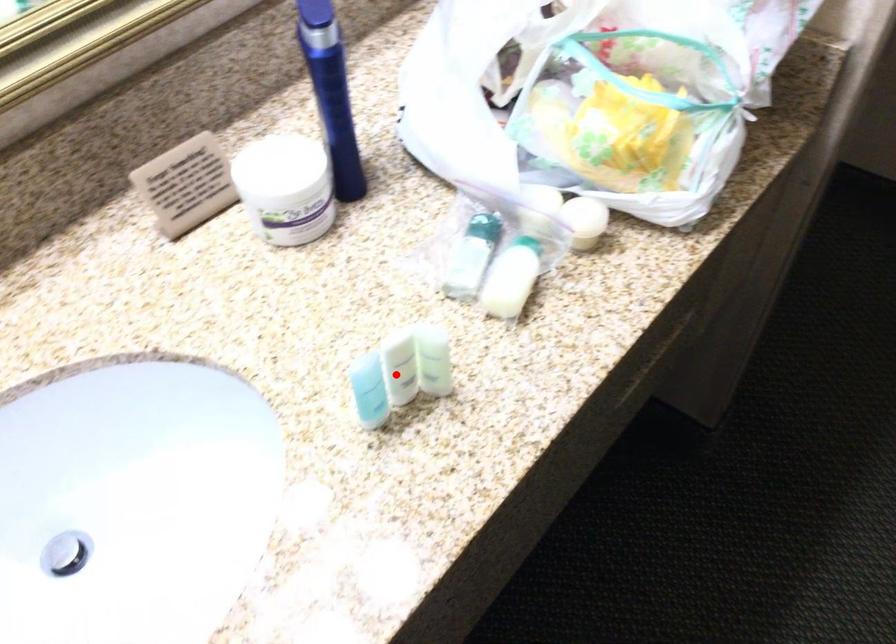
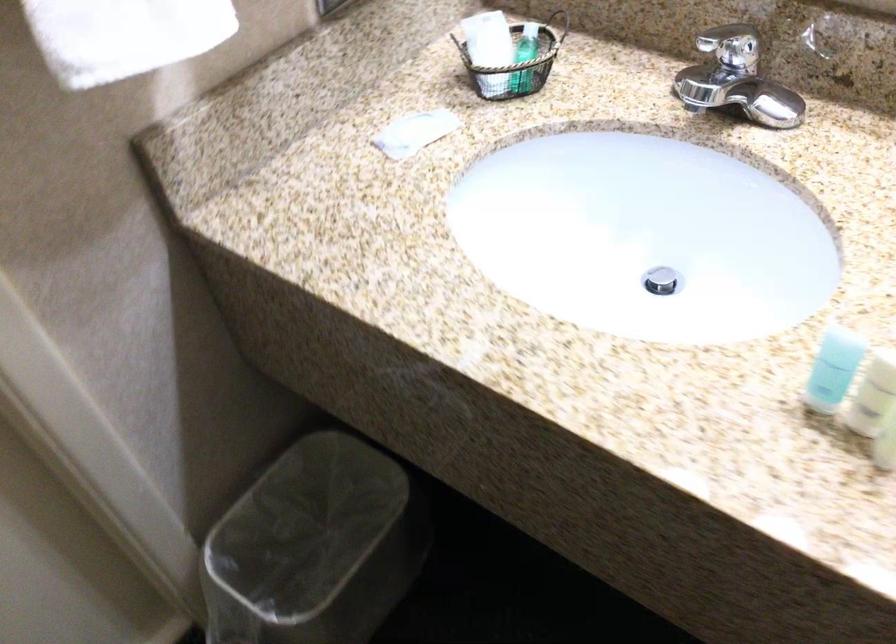
Question: I am providing you with two images of the same scene from different viewpoints. A red point is shown in image1. For the corresponding object point in image2, is it positioned nearer or farther from the camera?

Choices:
 (A) Nearer
 (B) Farther

Answer: (A)